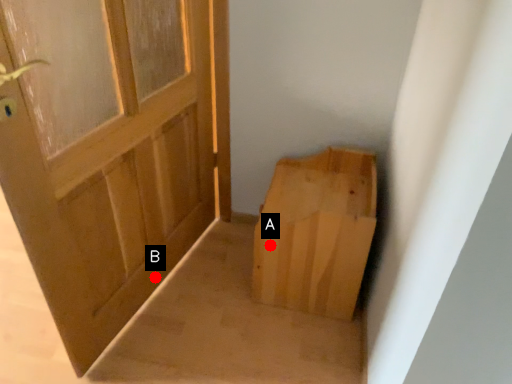
Question: Two points are circled on the image, labeled by A and B beside each circle. Among these points, which one is farthest from the camera?

Choices:
 (A) A is further
 (B) B is further

Answer: (B)